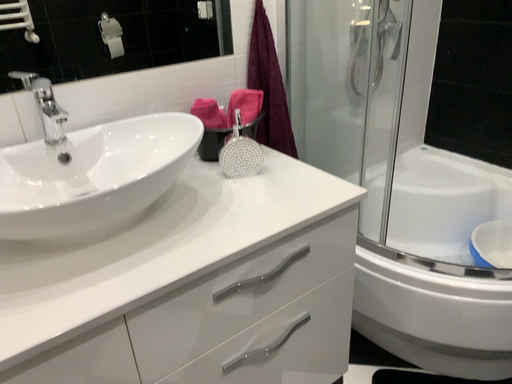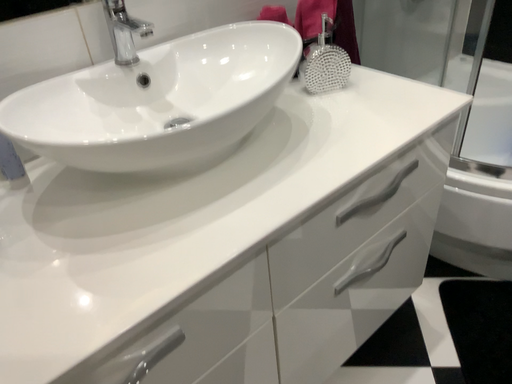
Question: Which way did the camera rotate in the video?

Choices:
 (A) rotated upward
 (B) rotated downward

Answer: (B)